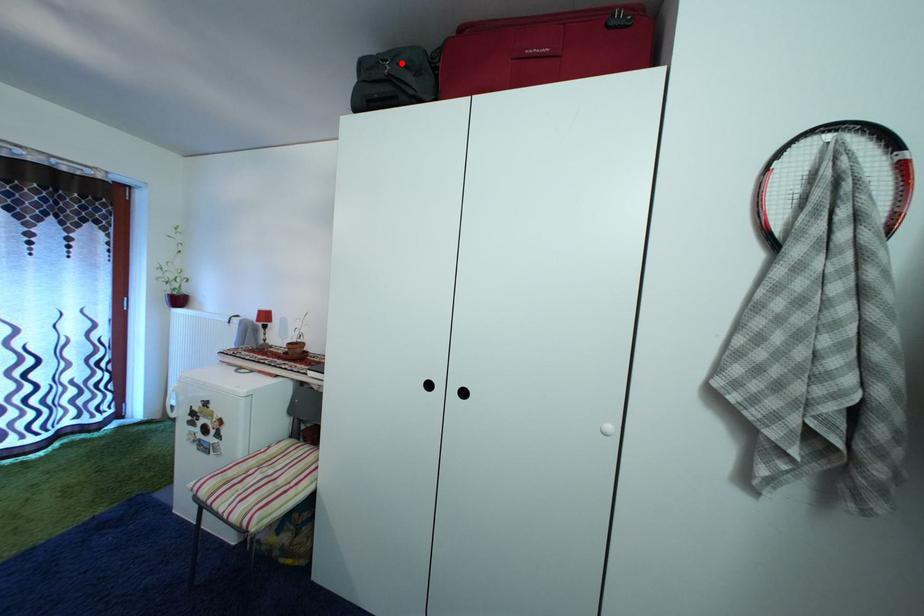
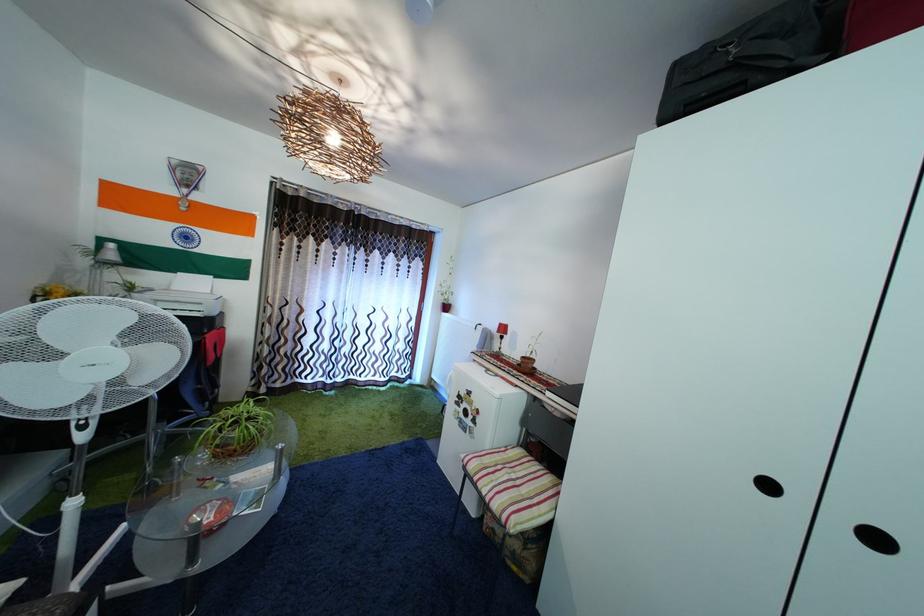
Find the pixel in the second image that matches the highlighted location in the first image.

(754, 38)